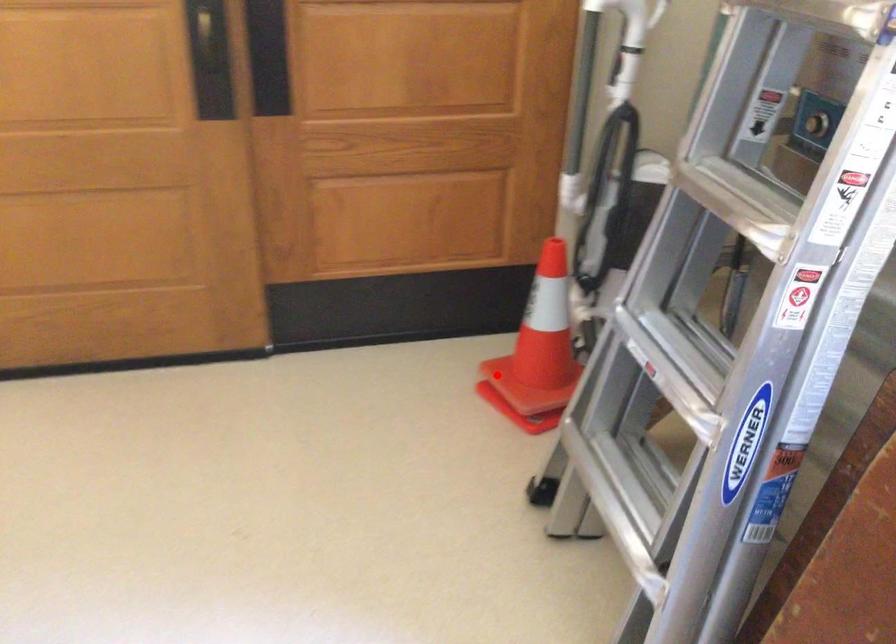
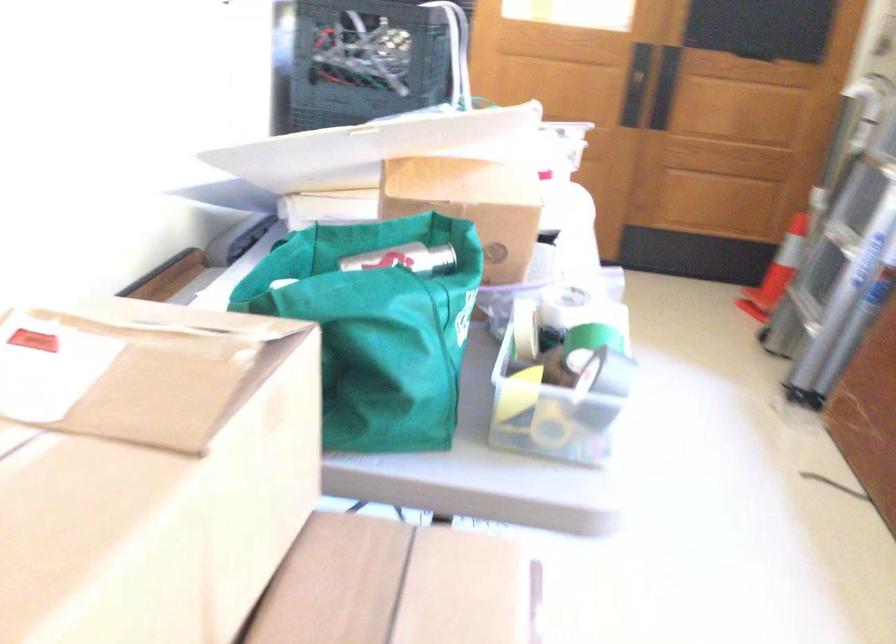
The point at the highlighted location is marked in the first image. Where is the corresponding point in the second image?

(777, 272)